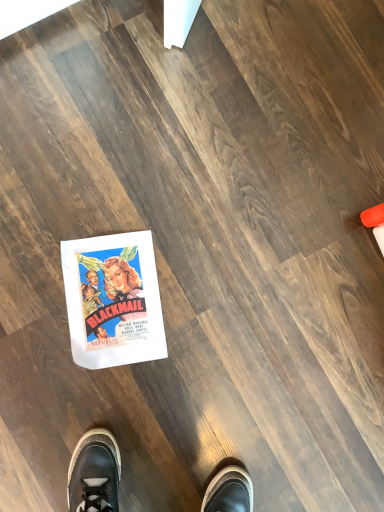
In order to face white paper at center, should I rotate leftwards or rightwards?

To face it directly, rotate left by 10.678 degrees.

In order to click on white paper at center in this screenshot , I will do `click(113, 300)`.

What do you see at coordinates (113, 300) in the screenshot?
I see `white paper at center` at bounding box center [113, 300].

This screenshot has width=384, height=512. Find the location of `white paper at center`. white paper at center is located at coordinates (113, 300).